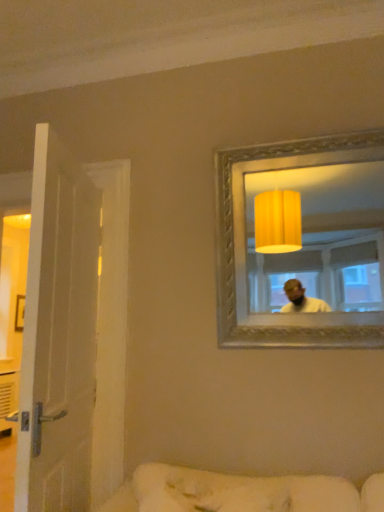
Identify the location of vacant point above gold textured mirror at upper right (from a real-world perspective). The height and width of the screenshot is (512, 384). click(x=300, y=132).